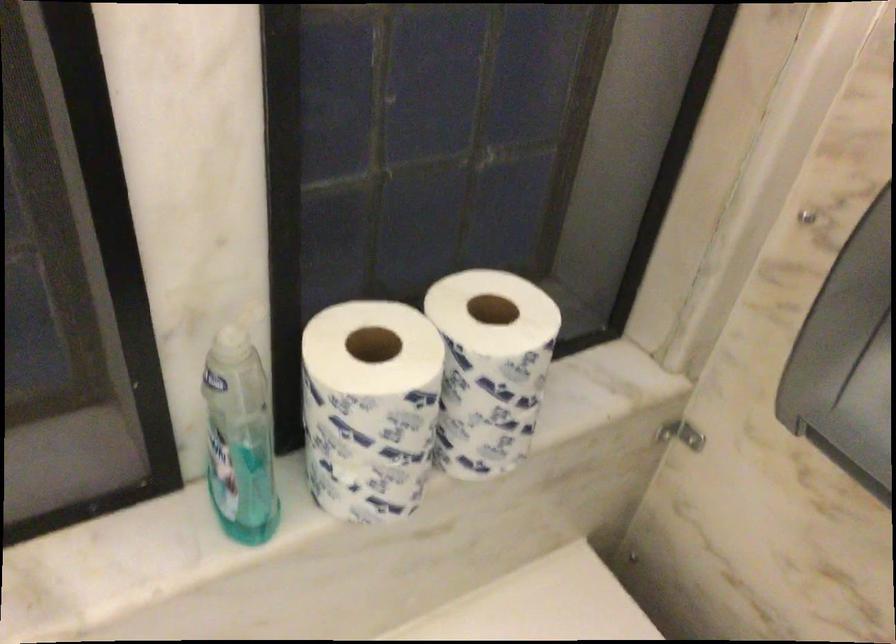
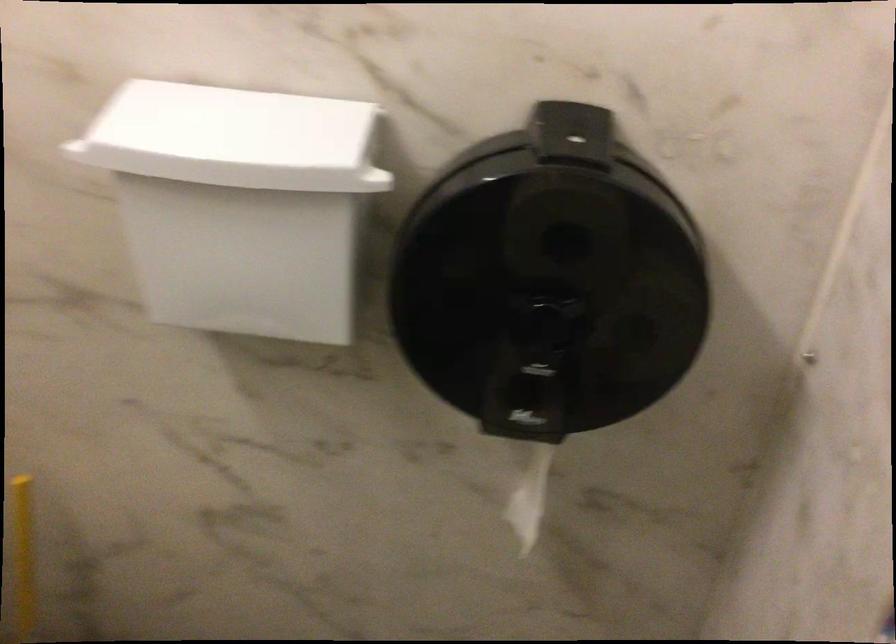
Question: The camera is either moving clockwise (left) or counter-clockwise (right) around the object. The first image is from the beginning of the video and the second image is from the end. Is the camera moving left or right when shooting the video?

Choices:
 (A) Left
 (B) Right

Answer: (A)